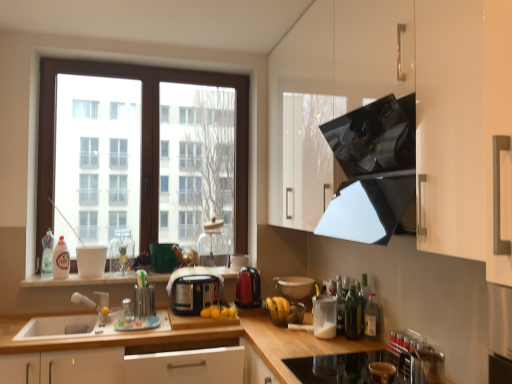
At what (x,y) coordinates should I click in order to perform the action: click on vacant space to the left of white matte container at center, the second kitchen appliance in the left-to-right sequence. Please return your answer as a coordinate pair (x, y). The image size is (512, 384). Looking at the image, I should click on (293, 337).